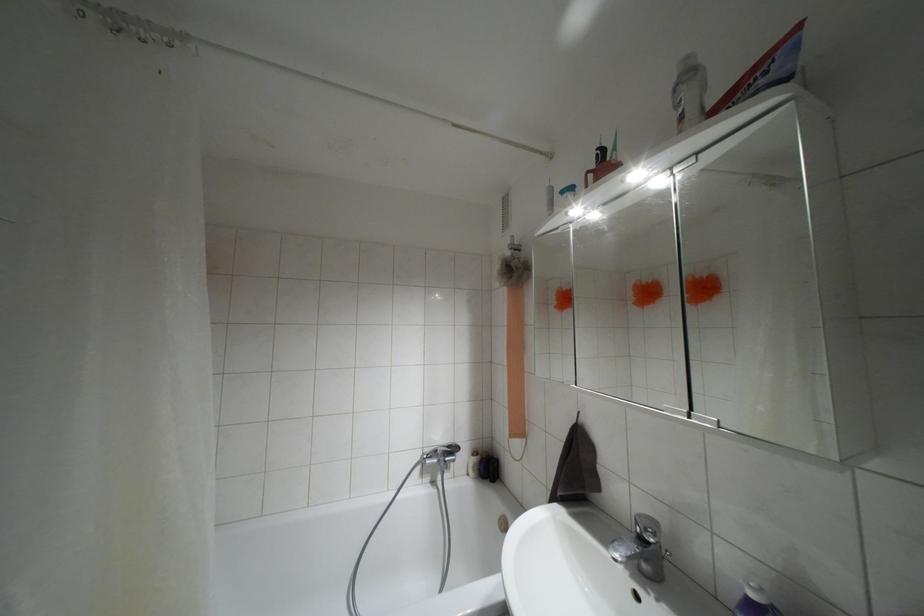
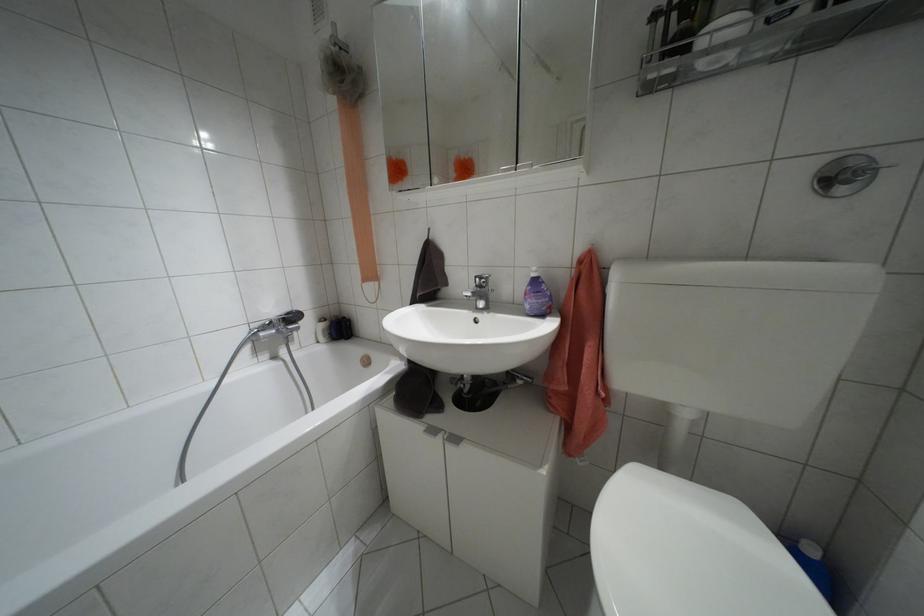
How did the camera likely rotate?

The rotation direction of the camera is right-down.